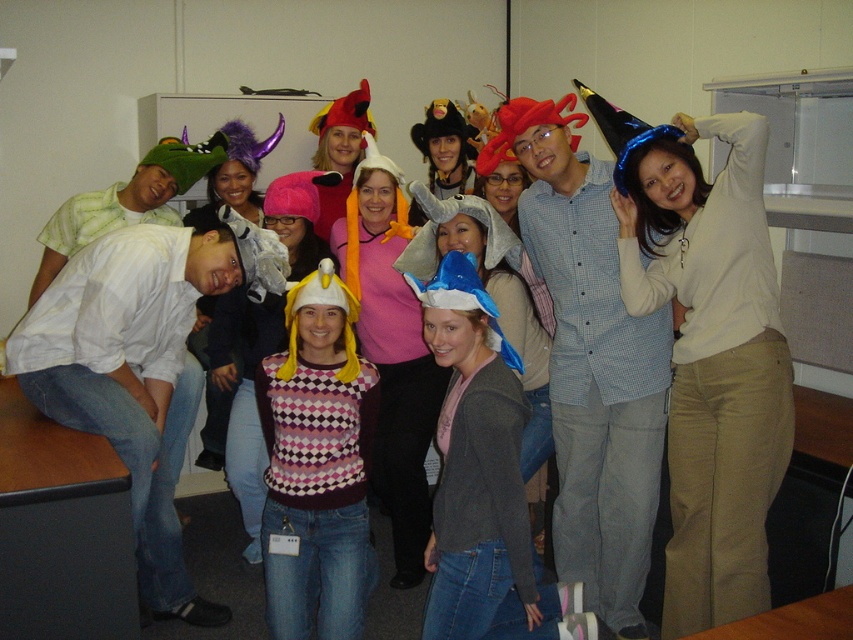
You are standing in the room and want to place a new decoration exactly at the same position as the blue glitter party hat at upper right. What are the coordinates where you should place it?

The blue glitter party hat at upper right is located at point (712,364), so you should place the new decoration at coordinates 0.569 and 0.837.

You are planning to wear one of the hats from the image for a costume party. If you want a taller hat, which one should you choose between the blue glitter party hat at upper right and the green fabric hat at left?

The blue glitter party hat at upper right is taller than the green fabric hat at left, so you should choose the blue glitter party hat at upper right for a taller option.

You are standing in the room and want to find the checkered fabric shirt at center. What are the coordinates where you should look?

The checkered fabric shirt at center is located at coordinates point [592,368].